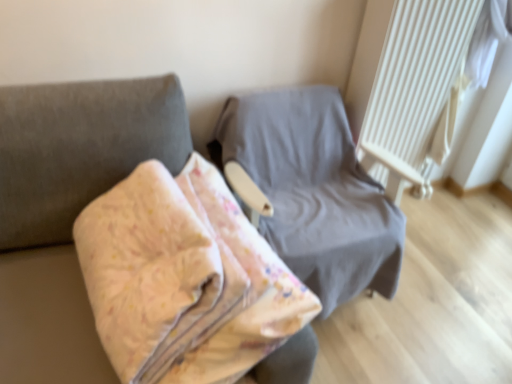
Question: Is gray fabric chair at center, the 2th furniture from the front, bigger than floral fabric blanket at center, the 1th furniture when ordered from front to back?

Choices:
 (A) yes
 (B) no

Answer: (A)

Question: Can you confirm if gray fabric chair at center, the 1th furniture in the back-to-front sequence, is wider than floral fabric blanket at center, the 1th furniture when ordered from front to back?

Choices:
 (A) yes
 (B) no

Answer: (B)

Question: Is the position of gray fabric chair at center, the 1th furniture in the back-to-front sequence, more distant than that of floral fabric blanket at center, arranged as the second furniture when viewed from the back?

Choices:
 (A) yes
 (B) no

Answer: (A)

Question: From a real-world perspective, is gray fabric chair at center, the 2th furniture from the front, physically below floral fabric blanket at center, arranged as the second furniture when viewed from the back?

Choices:
 (A) yes
 (B) no

Answer: (A)

Question: From the image's perspective, is gray fabric chair at center, the 1th furniture in the back-to-front sequence, on floral fabric blanket at center, the 1th furniture when ordered from front to back?

Choices:
 (A) no
 (B) yes

Answer: (B)

Question: Looking at the image, does white textured radiator at upper right seem bigger or smaller compared to gray fabric chair at center, the 2th furniture from the front?

Choices:
 (A) small
 (B) big

Answer: (A)

Question: Is white textured radiator at upper right to the left or to the right of gray fabric chair at center, the 1th furniture in the back-to-front sequence, in the image?

Choices:
 (A) left
 (B) right

Answer: (B)

Question: Is white textured radiator at upper right wider or thinner than gray fabric chair at center, the 2th furniture from the front?

Choices:
 (A) thin
 (B) wide

Answer: (A)

Question: From a real-world perspective, is white textured radiator at upper right above or below gray fabric chair at center, the 1th furniture in the back-to-front sequence?

Choices:
 (A) below
 (B) above

Answer: (B)

Question: Visually, is floral fabric blanket at center, the 1th furniture when ordered from front to back, positioned to the left or to the right of gray fabric chair at center, the 2th furniture from the front?

Choices:
 (A) right
 (B) left

Answer: (B)

Question: From a real-world perspective, relative to gray fabric chair at center, the 1th furniture in the back-to-front sequence, is floral fabric blanket at center, the 1th furniture when ordered from front to back, vertically above or below?

Choices:
 (A) above
 (B) below

Answer: (A)

Question: In terms of size, does floral fabric blanket at center, arranged as the second furniture when viewed from the back, appear bigger or smaller than gray fabric chair at center, the 1th furniture in the back-to-front sequence?

Choices:
 (A) big
 (B) small

Answer: (B)

Question: In the image, is floral fabric blanket at center, arranged as the second furniture when viewed from the back, positioned in front of or behind gray fabric chair at center, the 2th furniture from the front?

Choices:
 (A) front
 (B) behind

Answer: (A)

Question: Relative to floral fabric blanket at center, the 1th furniture when ordered from front to back, is white textured radiator at upper right in front or behind?

Choices:
 (A) front
 (B) behind

Answer: (B)

Question: Is white textured radiator at upper right inside the boundaries of floral fabric blanket at center, the 1th furniture when ordered from front to back, or outside?

Choices:
 (A) inside
 (B) outside

Answer: (B)